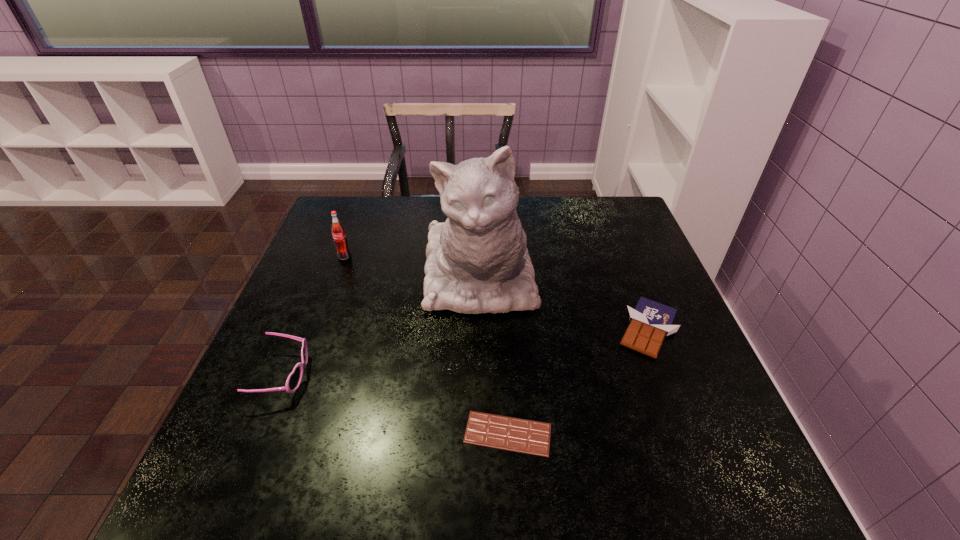
At what (x,y) coordinates should I click in order to perform the action: click on free region at the near left corner. Please return your answer as a coordinate pair (x, y). Image resolution: width=960 pixels, height=540 pixels. Looking at the image, I should click on (253, 510).

Where is `free spot between the shorter chocolate bar and the rightmost object`? The height and width of the screenshot is (540, 960). free spot between the shorter chocolate bar and the rightmost object is located at coordinates (578, 381).

Locate an element on the screen. The width and height of the screenshot is (960, 540). unoccupied position between the shortest object and the soda bottle is located at coordinates (426, 345).

The image size is (960, 540). I want to click on free area in between the nearest object and the soda bottle, so click(426, 345).

This screenshot has height=540, width=960. What are the coordinates of `free space between the sunglasses and the tallest object` in the screenshot? It's located at (382, 325).

Where is `unoccupied position between the left chocolate bar and the sunglasses`? unoccupied position between the left chocolate bar and the sunglasses is located at coordinates (396, 404).

This screenshot has height=540, width=960. Find the location of `blank region between the shorter chocolate bar and the third tallest object`. blank region between the shorter chocolate bar and the third tallest object is located at coordinates (396, 404).

This screenshot has height=540, width=960. I want to click on free space between the nearer chocolate bar and the soda bottle, so click(426, 345).

This screenshot has height=540, width=960. I want to click on empty space between the fourth shortest object and the third tallest object, so click(314, 315).

Identify the location of empty location between the sunglasses and the taller chocolate bar. (466, 352).